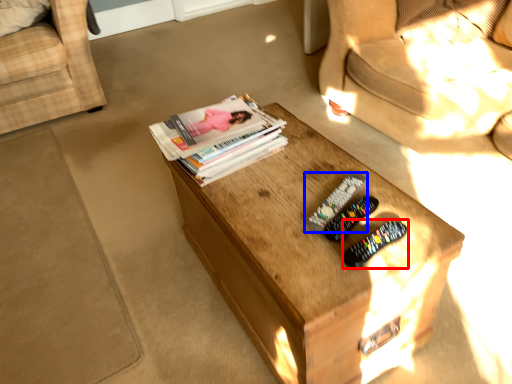
Question: Which of the following is the closest to the observer, remote control (highlighted by a red box) or remote control (highlighted by a blue box)?

Choices:
 (A) remote control
 (B) remote control

Answer: (A)